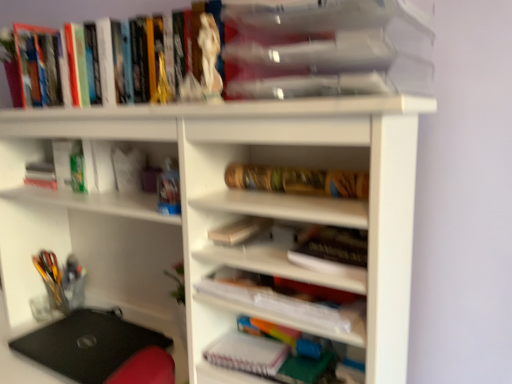
This screenshot has width=512, height=384. What do you see at coordinates (79, 10) in the screenshot?
I see `hardcover books at upper left, marked as the 1th book in a top-to-bottom arrangement` at bounding box center [79, 10].

In order to face wooden notebook at center-right, arranged as the 5th book when viewed from the top, should I rotate leftwards or rightwards?

Turn right approximately 10.885 degrees to face it.

This screenshot has height=384, width=512. What do you see at coordinates (329, 48) in the screenshot?
I see `clear plastic container at upper center, marked as the second book in a top-to-bottom arrangement` at bounding box center [329, 48].

Find the location of `matte white book at center, marked as the fourth book in a top-to-bottom arrangement`. matte white book at center, marked as the fourth book in a top-to-bottom arrangement is located at coordinates (239, 230).

Find the location of a particular element. The image size is (512, 384). hardcover books at upper left, which ranks as the sixth book in bottom-to-top order is located at coordinates (79, 10).

In the scene shown: From a real-world perspective, is gold textured tube at center, the third book from the top, below matte white book at center, which is counted as the 3th book, starting from the bottom?

No.

Which object is further away from the camera taking this photo, gold textured tube at center, the third book from the top, or matte white book at center, marked as the fourth book in a top-to-bottom arrangement?

matte white book at center, marked as the fourth book in a top-to-bottom arrangement, is further from the camera.

Looking at their sizes, would you say gold textured tube at center, the third book from the top, is wider or thinner than matte white book at center, marked as the fourth book in a top-to-bottom arrangement?

Clearly, gold textured tube at center, the third book from the top, has less width compared to matte white book at center, marked as the fourth book in a top-to-bottom arrangement.

Based on the photo, between gold textured tube at center, which appears as the 4th book when ordered from the bottom, and matte white book at center, which is counted as the 3th book, starting from the bottom, which one has less height?

matte white book at center, which is counted as the 3th book, starting from the bottom, is shorter.

Is clear plastic container at upper center, which is counted as the fifth book, starting from the bottom, inside or outside of hardcover books at upper left, which ranks as the sixth book in bottom-to-top order?

clear plastic container at upper center, which is counted as the fifth book, starting from the bottom, lies outside hardcover books at upper left, which ranks as the sixth book in bottom-to-top order.

The width and height of the screenshot is (512, 384). In order to click on the 4th book in front of the hardcover books at upper left, marked as the 1th book in a top-to-bottom arrangement, starting your count from the anchor in this screenshot , I will do `click(329, 48)`.

Is clear plastic container at upper center, marked as the second book in a top-to-bottom arrangement, wider or thinner than hardcover books at upper left, which ranks as the sixth book in bottom-to-top order?

Considering their sizes, clear plastic container at upper center, marked as the second book in a top-to-bottom arrangement, looks broader than hardcover books at upper left, which ranks as the sixth book in bottom-to-top order.

Locate an element on the screen. This screenshot has width=512, height=384. laptop on the left of gold textured tube at center, which appears as the 4th book when ordered from the bottom is located at coordinates (88, 344).

Considering the positions of point (246, 172) and point (29, 348), is point (246, 172) closer or farther from the camera than point (29, 348)?

Point (246, 172) is positioned closer to the camera compared to point (29, 348).

Which is correct: gold textured tube at center, the third book from the top, is inside black matte laptop at lower left, or outside of it?

gold textured tube at center, the third book from the top, cannot be found inside black matte laptop at lower left.

From a real-world perspective, is gold textured tube at center, the third book from the top, beneath black matte laptop at lower left?

No, from a real-world perspective, gold textured tube at center, the third book from the top, is not beneath black matte laptop at lower left.

Considering the positions of point (325, 228) and point (15, 15), is point (325, 228) closer or farther from the camera than point (15, 15)?

Point (325, 228).

Considering the relative sizes of wooden notebook at center-right, placed as the second book when sorted from bottom to top, and hardcover books at upper left, marked as the 1th book in a top-to-bottom arrangement, in the image provided, is wooden notebook at center-right, placed as the second book when sorted from bottom to top, bigger than hardcover books at upper left, marked as the 1th book in a top-to-bottom arrangement,?

Actually, wooden notebook at center-right, placed as the second book when sorted from bottom to top, might be smaller than hardcover books at upper left, marked as the 1th book in a top-to-bottom arrangement.

Considering the relative positions of wooden notebook at center-right, placed as the second book when sorted from bottom to top, and hardcover books at upper left, which ranks as the sixth book in bottom-to-top order, in the image provided, is wooden notebook at center-right, placed as the second book when sorted from bottom to top, to the right of hardcover books at upper left, which ranks as the sixth book in bottom-to-top order, from the viewer's perspective?

Correct, you'll find wooden notebook at center-right, placed as the second book when sorted from bottom to top, to the right of hardcover books at upper left, which ranks as the sixth book in bottom-to-top order.

Is wooden notebook at center-right, arranged as the 5th book when viewed from the top, thinner than hardcover books at upper left, marked as the 1th book in a top-to-bottom arrangement?

Correct, the width of wooden notebook at center-right, arranged as the 5th book when viewed from the top, is less than that of hardcover books at upper left, marked as the 1th book in a top-to-bottom arrangement.

Measure the distance from hardcover books at upper left, marked as the 1th book in a top-to-bottom arrangement, to clear plastic container at upper center, which is counted as the fifth book, starting from the bottom.

hardcover books at upper left, marked as the 1th book in a top-to-bottom arrangement, is 21.85 inches away from clear plastic container at upper center, which is counted as the fifth book, starting from the bottom.

Considering the positions of point (40, 0) and point (258, 6), is point (40, 0) closer or farther from the camera than point (258, 6)?

Clearly, point (40, 0) is more distant from the camera than point (258, 6).

From the image's perspective, which one is positioned lower, hardcover books at upper left, marked as the 1th book in a top-to-bottom arrangement, or clear plastic container at upper center, which is counted as the fifth book, starting from the bottom?

clear plastic container at upper center, which is counted as the fifth book, starting from the bottom, is shown below in the image.

Looking at their sizes, would you say hardcover books at upper left, marked as the 1th book in a top-to-bottom arrangement, is wider or thinner than clear plastic container at upper center, which is counted as the fifth book, starting from the bottom?

In the image, hardcover books at upper left, marked as the 1th book in a top-to-bottom arrangement, appears to be more narrow than clear plastic container at upper center, which is counted as the fifth book, starting from the bottom.

From the image's perspective, is black matte laptop at lower left located beneath matte white book at center, marked as the fourth book in a top-to-bottom arrangement?

Yes, from the image's perspective, black matte laptop at lower left is below matte white book at center, marked as the fourth book in a top-to-bottom arrangement.

Is black matte laptop at lower left positioned with its back to matte white book at center, marked as the fourth book in a top-to-bottom arrangement?

black matte laptop at lower left is not turned away from matte white book at center, marked as the fourth book in a top-to-bottom arrangement.

Considering the sizes of objects black matte laptop at lower left and matte white book at center, which is counted as the 3th book, starting from the bottom, in the image provided, who is smaller, black matte laptop at lower left or matte white book at center, which is counted as the 3th book, starting from the bottom,?

Smaller between the two is matte white book at center, which is counted as the 3th book, starting from the bottom.

Which is more to the right, black matte laptop at lower left or matte white book at center, marked as the fourth book in a top-to-bottom arrangement?

matte white book at center, marked as the fourth book in a top-to-bottom arrangement.

Which of these two, wooden notebook at center-right, arranged as the 5th book when viewed from the top, or gold textured tube at center, the third book from the top, is wider?

Wider between the two is wooden notebook at center-right, arranged as the 5th book when viewed from the top.

From a real-world perspective, does wooden notebook at center-right, arranged as the 5th book when viewed from the top, sit lower than gold textured tube at center, the third book from the top?

Indeed, from a real-world perspective, wooden notebook at center-right, arranged as the 5th book when viewed from the top, is positioned beneath gold textured tube at center, the third book from the top.

How far apart are wooden notebook at center-right, placed as the second book when sorted from bottom to top, and gold textured tube at center, which appears as the 4th book when ordered from the bottom?

A distance of 4.72 inches exists between wooden notebook at center-right, placed as the second book when sorted from bottom to top, and gold textured tube at center, which appears as the 4th book when ordered from the bottom.

Does point (310, 262) come farther from viewer compared to point (279, 183)?

No.

You are a GUI agent. You are given a task and a screenshot of the screen. Output one action in this format:
    pyautogui.click(x=<x>, y=<y>)
    Task: Click on the 2nd book to the right of the matte white book at center, which is counted as the 3th book, starting from the bottom, counting from the anchor's position
    Image resolution: width=512 pixels, height=384 pixels.
    Given the screenshot: What is the action you would take?
    pyautogui.click(x=298, y=180)

From the clear plastic container at upper center, marked as the second book in a top-to-bottom arrangement, count the 5th book to the left and point to it. Please provide its 2D coordinates.

[(79, 10)]

Based on their spatial positions, is black matte laptop at lower left or clear plastic container at upper center, which is counted as the fifth book, starting from the bottom, closer to hardcover books at upper left, which ranks as the sixth book in bottom-to-top order?

Based on the image, clear plastic container at upper center, which is counted as the fifth book, starting from the bottom, appears to be nearer to hardcover books at upper left, which ranks as the sixth book in bottom-to-top order.

Looking at the image, which one is located further to matte white book at center, which is counted as the 3th book, starting from the bottom, wooden notebook at center-right, placed as the second book when sorted from bottom to top, or white paper notebook at center, acting as the sixth book starting from the top?

Among the two, wooden notebook at center-right, placed as the second book when sorted from bottom to top, is located further to matte white book at center, which is counted as the 3th book, starting from the bottom.

Based on their spatial positions, is matte white book at center, marked as the fourth book in a top-to-bottom arrangement, or hardcover books at upper left, marked as the 1th book in a top-to-bottom arrangement, closer to white matte notebook at lower center?

The object closer to white matte notebook at lower center is matte white book at center, marked as the fourth book in a top-to-bottom arrangement.

Based on their spatial positions, is white matte notebook at lower center or clear plastic container at upper center, which is counted as the fifth book, starting from the bottom, further from matte white book at center, marked as the fourth book in a top-to-bottom arrangement?

clear plastic container at upper center, which is counted as the fifth book, starting from the bottom.

Which object lies further to the anchor point hardcover books at upper left, which ranks as the sixth book in bottom-to-top order, white matte notebook at lower center or black matte laptop at lower left?

white matte notebook at lower center lies further to hardcover books at upper left, which ranks as the sixth book in bottom-to-top order, than the other object.

Which object lies further to the anchor point gold textured tube at center, which appears as the 4th book when ordered from the bottom, white paper notebook at center, acting as the sixth book starting from the top, or black matte laptop at lower left?

Among the two, black matte laptop at lower left is located further to gold textured tube at center, which appears as the 4th book when ordered from the bottom.

Estimate the real-world distances between objects in this image. Which object is closer to gold textured tube at center, which appears as the 4th book when ordered from the bottom, black matte laptop at lower left or hardcover books at upper left, marked as the 1th book in a top-to-bottom arrangement?

black matte laptop at lower left lies closer to gold textured tube at center, which appears as the 4th book when ordered from the bottom, than the other object.

Considering their positions, is gold textured tube at center, the third book from the top, positioned closer to white matte notebook at lower center than matte white book at center, which is counted as the 3th book, starting from the bottom?

matte white book at center, which is counted as the 3th book, starting from the bottom, is positioned closer to the anchor white matte notebook at lower center.

Locate an element on the screen. This screenshot has width=512, height=384. paperback book located between black matte laptop at lower left and wooden notebook at center-right, placed as the second book when sorted from bottom to top, in the left-right direction is located at coordinates (247, 353).

Where is `book between wooden notebook at center-right, arranged as the 5th book when viewed from the top, and white matte notebook at lower center, in the vertical direction`? book between wooden notebook at center-right, arranged as the 5th book when viewed from the top, and white matte notebook at lower center, in the vertical direction is located at coordinates (283, 304).

This screenshot has width=512, height=384. I want to click on paperback book that lies between hardcover books at upper left, which ranks as the sixth book in bottom-to-top order, and black matte laptop at lower left from top to bottom, so tap(247, 353).

The image size is (512, 384). I want to click on paperback book between clear plastic container at upper center, which is counted as the fifth book, starting from the bottom, and black matte laptop at lower left, in the vertical direction, so click(x=247, y=353).